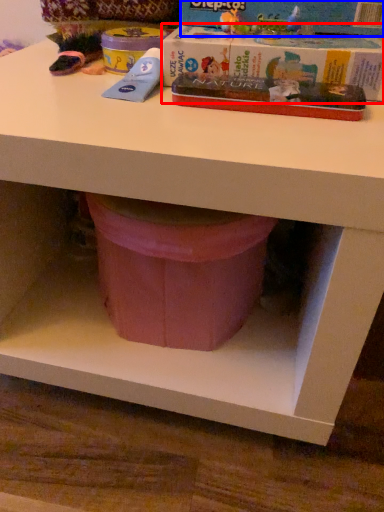
Question: Among these objects, which one is farthest to the camera, paperback book (highlighted by a red box) or paperback book (highlighted by a blue box)?

Choices:
 (A) paperback book
 (B) paperback book

Answer: (B)